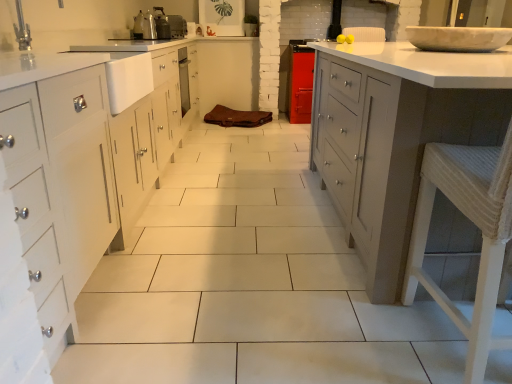
Question: Is metallic silver toaster at upper center, which ranks as the first appliance in bottom-to-top order, smaller than white marble bowl at upper right?

Choices:
 (A) no
 (B) yes

Answer: (B)

Question: Is metallic silver toaster at upper center, which ranks as the 1th appliance in front-to-back order, shorter than white marble bowl at upper right?

Choices:
 (A) no
 (B) yes

Answer: (A)

Question: From the image's perspective, does metallic silver toaster at upper center, positioned as the 2th appliance in back-to-front order, appear higher than white marble bowl at upper right?

Choices:
 (A) yes
 (B) no

Answer: (A)

Question: Is metallic silver toaster at upper center, which is the 2th appliance in top-to-bottom order, next to white marble bowl at upper right?

Choices:
 (A) no
 (B) yes

Answer: (A)

Question: From the image's perspective, is metallic silver toaster at upper center, which ranks as the first appliance in bottom-to-top order, beneath white marble bowl at upper right?

Choices:
 (A) no
 (B) yes

Answer: (A)

Question: Looking at their shapes, would you say white marble bowl at upper right is wider or thinner than metallic silver toaster at upper center, which ranks as the first appliance in bottom-to-top order?

Choices:
 (A) wide
 (B) thin

Answer: (A)

Question: From a real-world perspective, is white marble bowl at upper right physically located above or below metallic silver toaster at upper center, which ranks as the first appliance in bottom-to-top order?

Choices:
 (A) below
 (B) above

Answer: (A)

Question: Is white marble bowl at upper right bigger or smaller than metallic silver toaster at upper center, which ranks as the first appliance in bottom-to-top order?

Choices:
 (A) big
 (B) small

Answer: (A)

Question: Is white marble bowl at upper right to the left or to the right of metallic silver toaster at upper center, which ranks as the first appliance in bottom-to-top order, in the image?

Choices:
 (A) left
 (B) right

Answer: (B)

Question: Is white glossy countertop at right situated inside metallic silver toaster at upper center, the 1th appliance when ordered from top to bottom, or outside?

Choices:
 (A) inside
 (B) outside

Answer: (B)

Question: Considering the positions of white glossy countertop at right and metallic silver toaster at upper center, acting as the 2th appliance starting from the front, in the image, is white glossy countertop at right taller or shorter than metallic silver toaster at upper center, acting as the 2th appliance starting from the front,?

Choices:
 (A) tall
 (B) short

Answer: (A)

Question: Considering the positions of white glossy countertop at right and metallic silver toaster at upper center, acting as the 2th appliance starting from the front, in the image, is white glossy countertop at right wider or thinner than metallic silver toaster at upper center, acting as the 2th appliance starting from the front,?

Choices:
 (A) thin
 (B) wide

Answer: (B)

Question: In the image, is white glossy countertop at right positioned in front of or behind metallic silver toaster at upper center, which is counted as the second appliance, starting from the bottom?

Choices:
 (A) front
 (B) behind

Answer: (A)

Question: Is point (154, 34) positioned closer to the camera than point (470, 49)?

Choices:
 (A) farther
 (B) closer

Answer: (A)

Question: Looking at their shapes, would you say metallic silver toaster at upper center, which is the 2th appliance in top-to-bottom order, is wider or thinner than white marble bowl at upper right?

Choices:
 (A) thin
 (B) wide

Answer: (A)